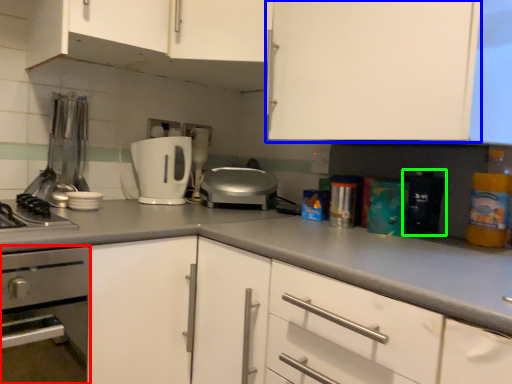
Question: Which object is positioned closest to home appliance (highlighted by a red box)? Select from cabinetry (highlighted by a blue box) and appliance (highlighted by a green box).

Choices:
 (A) cabinetry
 (B) appliance

Answer: (A)